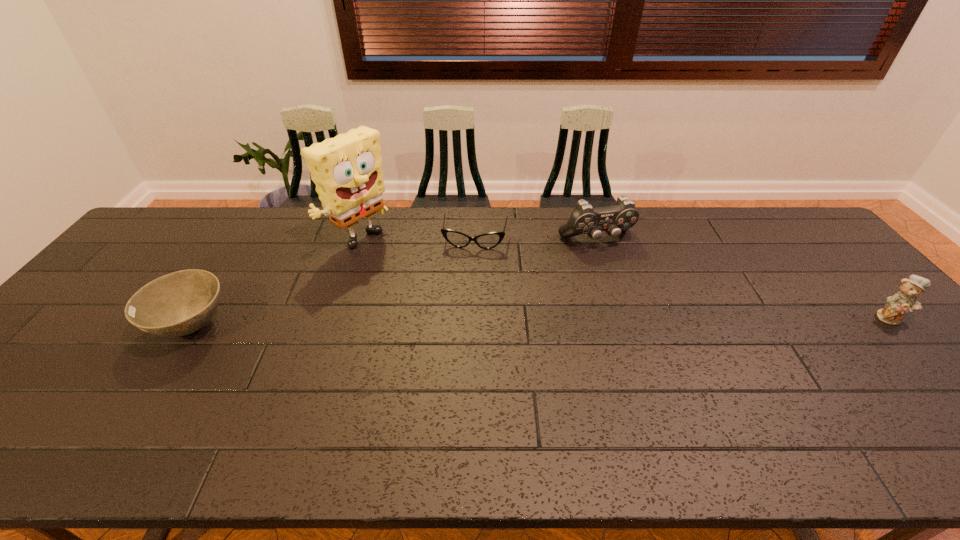
The image size is (960, 540). What are the coordinates of `blank area located on the face of the sponge` in the screenshot? It's located at (433, 296).

The height and width of the screenshot is (540, 960). I want to click on free region located 0.070m on the face of the sponge, so click(394, 269).

Image resolution: width=960 pixels, height=540 pixels. I want to click on vacant position located on the face of the sponge, so click(x=412, y=281).

Locate an element on the screen. vacant space situated 0.060m on the surface of the control with buttons is located at coordinates (614, 263).

I want to click on free region located 0.140m on the surface of the control with buttons, so click(626, 280).

At what (x,y) coordinates should I click in order to perform the action: click on vacant space located 0.120m on the surface of the control with buttons. Please return your answer as a coordinate pair (x, y). This screenshot has width=960, height=540. Looking at the image, I should click on (623, 276).

I want to click on free space located 0.300m on the front-facing side of the spectacles, so point(460,322).

Identify the location of vacant space situated on the front-facing side of the spectacles. The image size is (960, 540). (469, 266).

Locate an element on the screen. This screenshot has width=960, height=540. free location located 0.230m on the front-facing side of the spectacles is located at coordinates (464, 303).

At what (x,y) coordinates should I click in order to perform the action: click on sponge that is at the far edge. Please return your answer as a coordinate pair (x, y). The image size is (960, 540). Looking at the image, I should click on (347, 170).